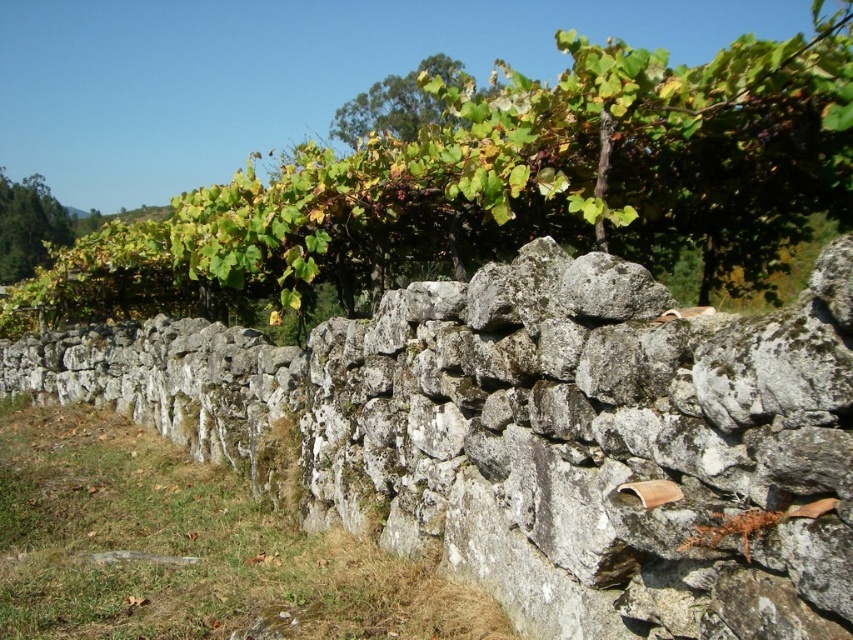
You are a painter standing in front of the gray rough stone wall at center and the green leafy vine at upper center. You want to paint both, but your canvas can only accommodate the taller object. Which one should you choose?

The green leafy vine at upper center is taller than the gray rough stone wall at center, so you should choose to paint the green leafy vine at upper center.

You are standing in front of a rustic stone wall. A gray rough stone wall at center is marked by a point at coordinates (537, 436). If you were to place a small statue exactly at that point, would it be on the wall?

Yes, the gray rough stone wall at center is represented by the point at coordinates (537, 436), so placing a small statue there would position it directly on the wall.

You are an artist sketching the scene. You need to decide which object to draw first based on their thickness. Which one should you start with, the gray rough stone wall at center or the green leafy vine at upper center?

The gray rough stone wall at center is thinner than the green leafy vine at upper center, so you should start by drawing the green leafy vine at upper center first since it has a greater thickness and might require more detailed work.